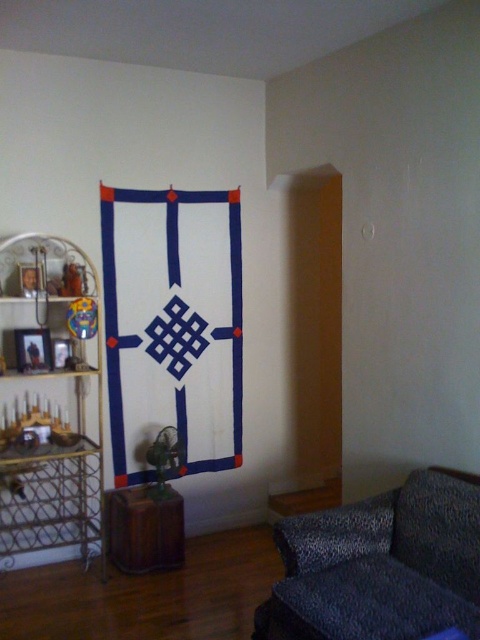
You are standing in the room and want to place a 3.5 feet wide painting on the wall behind the metallic gold shelving unit at left. Can the painting fit horizontally between the shelving unit and the corner of the room?

The metallic gold shelving unit at left is 9.55 feet from the viewer. However, without knowing the distance from the shelving unit to the corner, it is impossible to determine if the painting will fit.

You are a guest in the room and want to sit on the leopard print fabric couch at lower right. Can you easily stand up from there without bumping your head on the metallic gold shelving unit at left?

The leopard print fabric couch at lower right is not as tall as the metallic gold shelving unit at left, so you can easily stand up without hitting your head.